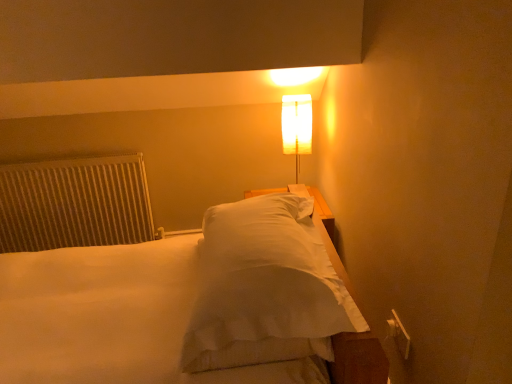
Question: Is white textured radiator at left facing towards white fabric lamp at upper center?

Choices:
 (A) yes
 (B) no

Answer: (B)

Question: Is white textured radiator at left facing away from white fabric lamp at upper center?

Choices:
 (A) no
 (B) yes

Answer: (A)

Question: From a real-world perspective, is white textured radiator at left located higher than white fabric lamp at upper center?

Choices:
 (A) no
 (B) yes

Answer: (A)

Question: From the image's perspective, is white textured radiator at left over white fabric lamp at upper center?

Choices:
 (A) no
 (B) yes

Answer: (A)

Question: Would you say white textured radiator at left contains white fabric lamp at upper center?

Choices:
 (A) yes
 (B) no

Answer: (B)

Question: Can you confirm if white textured radiator at left is shorter than white fabric lamp at upper center?

Choices:
 (A) no
 (B) yes

Answer: (A)

Question: Can you confirm if white soft bed at center is thinner than white fabric lamp at upper center?

Choices:
 (A) no
 (B) yes

Answer: (A)

Question: Is white soft bed at center oriented away from white fabric lamp at upper center?

Choices:
 (A) no
 (B) yes

Answer: (A)

Question: From the image's perspective, is white soft bed at center located beneath white fabric lamp at upper center?

Choices:
 (A) no
 (B) yes

Answer: (B)

Question: Considering the relative positions of white soft bed at center and white fabric lamp at upper center in the image provided, is white soft bed at center to the right of white fabric lamp at upper center from the viewer's perspective?

Choices:
 (A) yes
 (B) no

Answer: (B)

Question: From a real-world perspective, is white soft bed at center located higher than white fabric lamp at upper center?

Choices:
 (A) yes
 (B) no

Answer: (B)

Question: From a real-world perspective, is white soft bed at center below white fabric lamp at upper center?

Choices:
 (A) no
 (B) yes

Answer: (B)

Question: From the image's perspective, is white fabric lamp at upper center located above white soft bed at center?

Choices:
 (A) no
 (B) yes

Answer: (B)